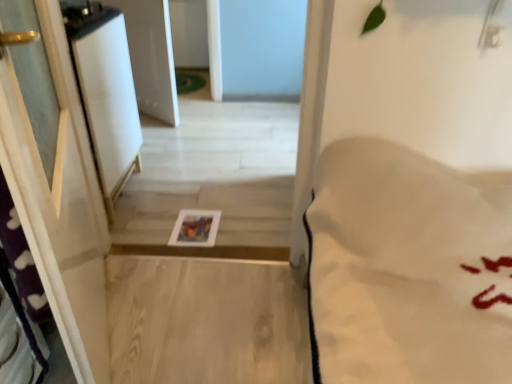
Question: Is white glossy screen door at left taller than white soft bedsheet at right?

Choices:
 (A) no
 (B) yes

Answer: (A)

Question: From a real-world perspective, is white glossy screen door at left under white soft bedsheet at right?

Choices:
 (A) yes
 (B) no

Answer: (B)

Question: From the image's perspective, is white glossy screen door at left on top of white soft bedsheet at right?

Choices:
 (A) no
 (B) yes

Answer: (B)

Question: Does white glossy screen door at left come behind white soft bedsheet at right?

Choices:
 (A) no
 (B) yes

Answer: (B)

Question: Is white glossy screen door at left positioned far away from white soft bedsheet at right?

Choices:
 (A) no
 (B) yes

Answer: (B)

Question: Is white glossy screen door at left bigger than white soft bedsheet at right?

Choices:
 (A) no
 (B) yes

Answer: (A)

Question: Does white soft bedsheet at right have a larger size compared to white glossy screen door at left?

Choices:
 (A) yes
 (B) no

Answer: (A)

Question: Is white soft bedsheet at right smaller than white glossy screen door at left?

Choices:
 (A) no
 (B) yes

Answer: (A)

Question: Is white soft bedsheet at right in contact with white glossy screen door at left?

Choices:
 (A) no
 (B) yes

Answer: (A)

Question: Is the position of white soft bedsheet at right more distant than that of white glossy screen door at left?

Choices:
 (A) yes
 (B) no

Answer: (B)

Question: Is white soft bedsheet at right far from white glossy screen door at left?

Choices:
 (A) no
 (B) yes

Answer: (B)

Question: Is white soft bedsheet at right wider than white glossy screen door at left?

Choices:
 (A) yes
 (B) no

Answer: (A)

Question: Is white glossy screen door at left to the left or to the right of white soft bedsheet at right in the image?

Choices:
 (A) left
 (B) right

Answer: (A)